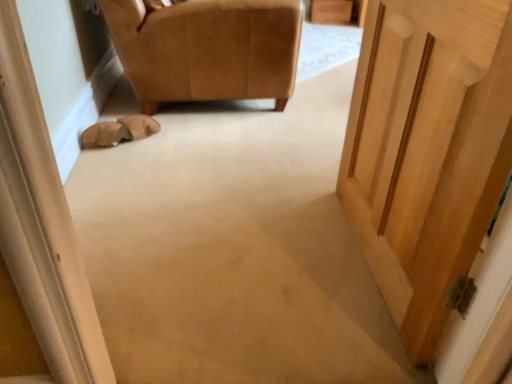
Question: Can you confirm if leather at left is shorter than leather at upper left?

Choices:
 (A) yes
 (B) no

Answer: (A)

Question: Considering the relative sizes of leather at left and leather at upper left in the image provided, is leather at left bigger than leather at upper left?

Choices:
 (A) yes
 (B) no

Answer: (B)

Question: Is leather at left located outside leather at upper left?

Choices:
 (A) yes
 (B) no

Answer: (A)

Question: Considering the relative positions of leather at left and leather at upper left in the image provided, is leather at left to the left of leather at upper left from the viewer's perspective?

Choices:
 (A) yes
 (B) no

Answer: (A)

Question: Is leather at left positioned far away from leather at upper left?

Choices:
 (A) yes
 (B) no

Answer: (B)

Question: From a real-world perspective, is leather at left physically below leather at upper left?

Choices:
 (A) yes
 (B) no

Answer: (A)

Question: Is leather at upper left positioned with its back to leather at left?

Choices:
 (A) no
 (B) yes

Answer: (A)

Question: From a real-world perspective, is leather at upper left physically below leather at left?

Choices:
 (A) yes
 (B) no

Answer: (B)

Question: Can you confirm if leather at upper left is smaller than leather at left?

Choices:
 (A) yes
 (B) no

Answer: (B)

Question: Can you confirm if leather at upper left is wider than leather at left?

Choices:
 (A) yes
 (B) no

Answer: (A)

Question: Does leather at upper left appear on the right side of leather at left?

Choices:
 (A) no
 (B) yes

Answer: (B)

Question: From the image's perspective, is leather at upper left above leather at left?

Choices:
 (A) yes
 (B) no

Answer: (A)

Question: Considering the positions of leather at upper left and leather at left in the image, is leather at upper left bigger or smaller than leather at left?

Choices:
 (A) big
 (B) small

Answer: (A)